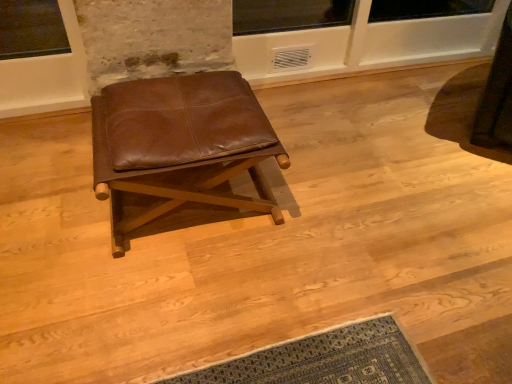
Question: Should I look upward or downward to see brown leather stool at center?

Choices:
 (A) down
 (B) up

Answer: (B)